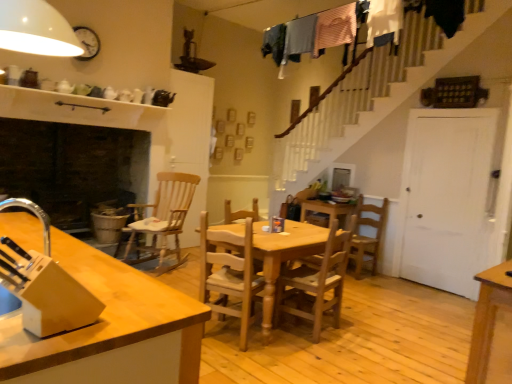
Where is `free space in front of light brown wooden chair at center, the 2th chair positioned from the left`? free space in front of light brown wooden chair at center, the 2th chair positioned from the left is located at coordinates (234, 364).